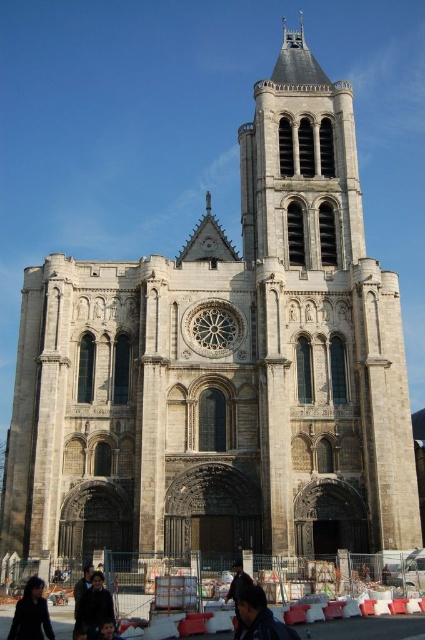
From the picture: Who is lower down, dark blue jacket at lower center or dark brown hair at lower left?

dark brown hair at lower left

Does dark blue jacket at lower center have a greater width compared to dark brown hair at lower left?

In fact, dark blue jacket at lower center might be narrower than dark brown hair at lower left.

Image resolution: width=425 pixels, height=640 pixels. What are the coordinates of `dark blue jacket at lower center` in the screenshot? It's located at (258, 618).

Is dark brown hair at lower left above dark brown leather jacket at center?

Actually, dark brown hair at lower left is below dark brown leather jacket at center.

Is point (17, 634) farther from camera compared to point (238, 564)?

No, it is not.

Between point (47, 608) and point (238, 573), which one is positioned in front?

Point (47, 608)

I want to click on dark brown hair at lower left, so click(x=31, y=612).

Is dark blue jacket at lower center to the left of dark blue jacket at lower left from the viewer's perspective?

Incorrect, dark blue jacket at lower center is not on the left side of dark blue jacket at lower left.

Does dark blue jacket at lower center come behind dark blue jacket at lower left?

No, dark blue jacket at lower center is closer to the viewer.

Describe the element at coordinates (258, 618) in the screenshot. The height and width of the screenshot is (640, 425). I see `dark blue jacket at lower center` at that location.

You are a GUI agent. You are given a task and a screenshot of the screen. Output one action in this format:
    pyautogui.click(x=<x>, y=<y>)
    Task: Click on the dark blue jacket at lower center
    
    Given the screenshot: What is the action you would take?
    pyautogui.click(x=258, y=618)